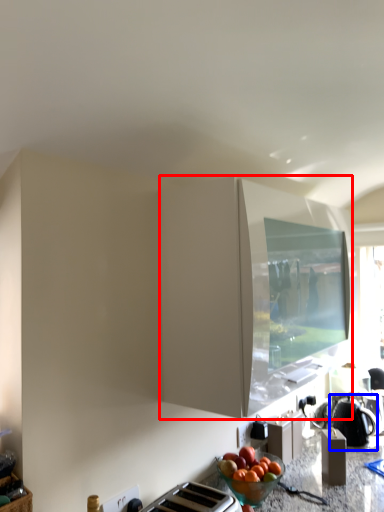
Question: Among these objects, which one is nearest to the camera, cabinetry (highlighted by a red box) or kettle (highlighted by a blue box)?

Choices:
 (A) cabinetry
 (B) kettle

Answer: (A)